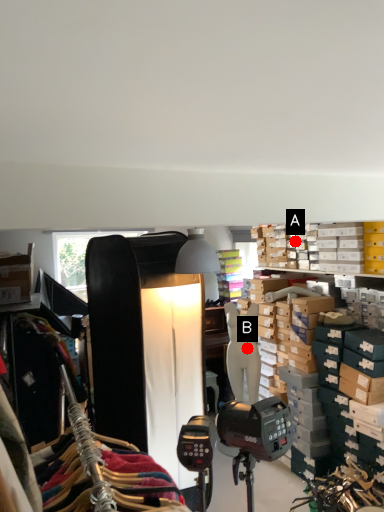
Question: Two points are circled on the image, labeled by A and B beside each circle. Which of the following is the farthest from the observer?

Choices:
 (A) A is further
 (B) B is further

Answer: (A)